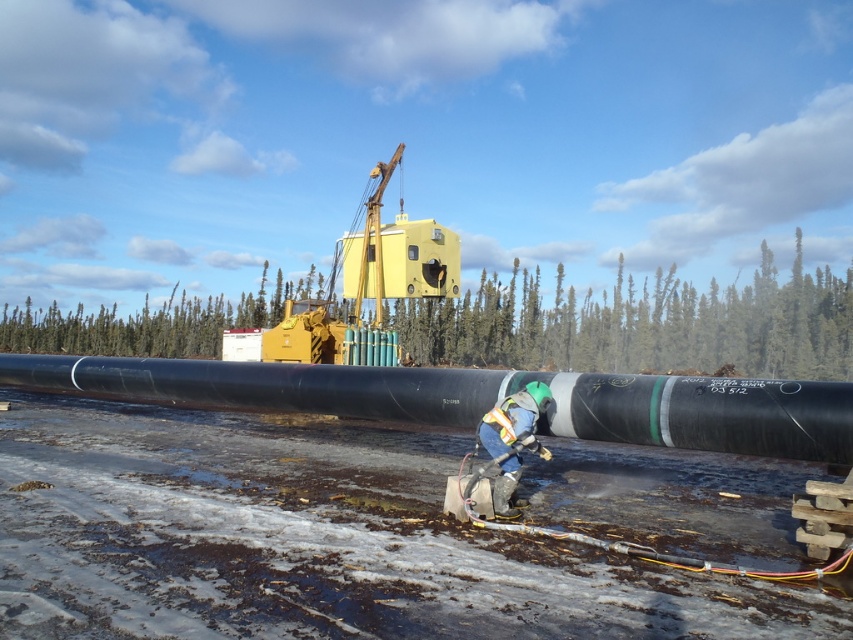
Question: Does black rubber pipe at center have a greater width compared to reflective silver helmet at center?

Choices:
 (A) yes
 (B) no

Answer: (A)

Question: Which object appears closest to the camera in this image?

Choices:
 (A) reflective silver helmet at center
 (B) black rubber pipe at center

Answer: (B)

Question: Which point is farther to the camera?

Choices:
 (A) black rubber pipe at center
 (B) reflective silver helmet at center

Answer: (B)

Question: Which object is closer to the camera taking this photo?

Choices:
 (A) reflective silver helmet at center
 (B) black rubber pipe at center

Answer: (B)

Question: Does black rubber pipe at center have a smaller size compared to reflective silver helmet at center?

Choices:
 (A) no
 (B) yes

Answer: (A)

Question: Does black rubber pipe at center have a smaller size compared to reflective silver helmet at center?

Choices:
 (A) no
 (B) yes

Answer: (A)